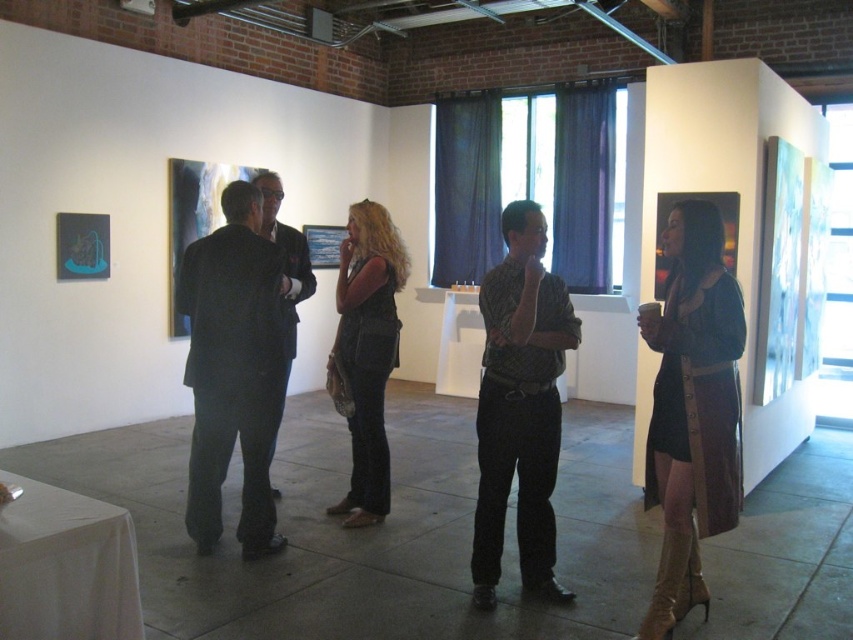
You are an art gallery visitor standing in the center of the room. You see the leather dress at center and the denim vest at center. Which one is positioned to the right?

The leather dress at center is positioned to the right of the denim vest at center.